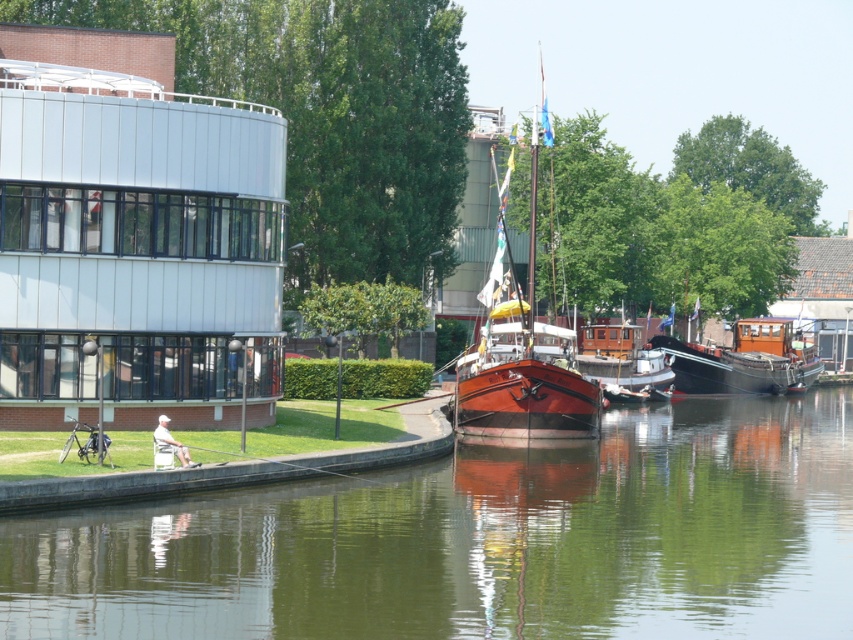
Consider the image. Which is more to the left, shiny brown wooden boat at center or white fabric at lower left?

white fabric at lower left is more to the left.

Describe the element at coordinates (521, 348) in the screenshot. I see `shiny brown wooden boat at center` at that location.

Find the location of `shiny brown wooden boat at center`. shiny brown wooden boat at center is located at coordinates (521, 348).

Where is `green smooth water at center`? green smooth water at center is located at coordinates (482, 541).

What are the coordinates of `green smooth water at center` in the screenshot? It's located at pos(482,541).

Is wooden polished boat at right above wooden boat at center?

Incorrect, wooden polished boat at right is not positioned above wooden boat at center.

Does wooden polished boat at right have a greater height compared to wooden boat at center?

Correct, wooden polished boat at right is much taller as wooden boat at center.

Is point (817, 358) closer to viewer compared to point (651, 362)?

No, (817, 358) is further to viewer.

Find the location of a particular element. wooden polished boat at right is located at coordinates (743, 360).